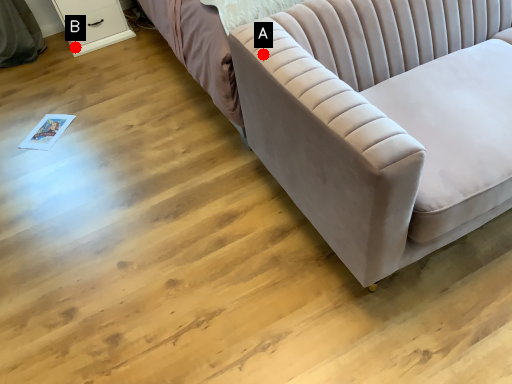
Question: Two points are circled on the image, labeled by A and B beside each circle. Which point is closer to the camera?

Choices:
 (A) A is closer
 (B) B is closer

Answer: (A)